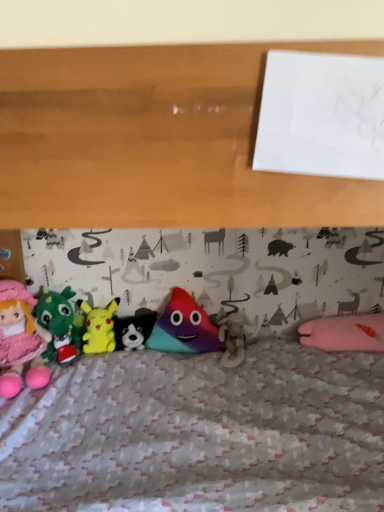
Image resolution: width=384 pixels, height=512 pixels. In order to click on yellow plush toy at center, acting as the fourth toy starting from the right in this screenshot , I will do `click(99, 327)`.

The image size is (384, 512). What do you see at coordinates (231, 337) in the screenshot?
I see `fluffy white teddy bear at center, the 1th toy when ordered from right to left` at bounding box center [231, 337].

Measure the distance between point (224,345) and camera.

A distance of 1.73 meters exists between point (224,345) and camera.

The image size is (384, 512). Describe the element at coordinates (20, 340) in the screenshot. I see `matte pink plush doll at left, which is counted as the 6th toy, starting from the right` at that location.

Identify the location of yellow plush toy at center, acting as the fourth toy starting from the right. (99, 327).

From the image's perspective, which one is positioned lower, multicolored plush toy at center, which is the second toy from right to left, or matte pink plush doll at left, which is counted as the 6th toy, starting from the right?

matte pink plush doll at left, which is counted as the 6th toy, starting from the right, from the image's perspective.

In the scene shown: Is multicolored plush toy at center, which is the second toy from right to left, looking in the opposite direction of matte pink plush doll at left, which is counted as the first toy, starting from the left?

No, multicolored plush toy at center, which is the second toy from right to left,'s orientation is not away from matte pink plush doll at left, which is counted as the first toy, starting from the left.

Can you tell me how much multicolored plush toy at center, which is the second toy from right to left, and matte pink plush doll at left, which is counted as the first toy, starting from the left, differ in facing direction?

multicolored plush toy at center, which is the second toy from right to left, and matte pink plush doll at left, which is counted as the first toy, starting from the left, are facing 34.4 degrees away from each other.

Considering the sizes of white plush dog at center, marked as the fourth toy in a left-to-right arrangement, and multicolored plush toy at center, which is the second toy from right to left, in the image, is white plush dog at center, marked as the fourth toy in a left-to-right arrangement, wider or thinner than multicolored plush toy at center, which is the second toy from right to left,?

white plush dog at center, marked as the fourth toy in a left-to-right arrangement, is wider than multicolored plush toy at center, which is the second toy from right to left.

Can you see white plush dog at center, arranged as the third toy when viewed from the right, touching multicolored plush toy at center, which appears as the 5th toy when viewed from the left?

No, white plush dog at center, arranged as the third toy when viewed from the right, is not in contact with multicolored plush toy at center, which appears as the 5th toy when viewed from the left.

Does white plush dog at center, arranged as the third toy when viewed from the right, turn towards multicolored plush toy at center, which is the second toy from right to left?

No, white plush dog at center, arranged as the third toy when viewed from the right, is not aimed at multicolored plush toy at center, which is the second toy from right to left.

Choose the correct answer: Is white plush dog at center, arranged as the third toy when viewed from the right, inside multicolored plush toy at center, which is the second toy from right to left, or outside it?

white plush dog at center, arranged as the third toy when viewed from the right, lies outside multicolored plush toy at center, which is the second toy from right to left.

Considering their positions, is matte pink plush doll at left, which is counted as the 6th toy, starting from the right, located in front of or behind fluffy white teddy bear at center, which ranks as the 6th toy in left-to-right order?

In the image, matte pink plush doll at left, which is counted as the 6th toy, starting from the right, appears in front of fluffy white teddy bear at center, which ranks as the 6th toy in left-to-right order.

Is matte pink plush doll at left, which is counted as the 6th toy, starting from the right, inside or outside of fluffy white teddy bear at center, which ranks as the 6th toy in left-to-right order?

matte pink plush doll at left, which is counted as the 6th toy, starting from the right, is spatially situated outside fluffy white teddy bear at center, which ranks as the 6th toy in left-to-right order.

Which is in front, point (16, 368) or point (235, 340)?

Point (16, 368)

Does point (44, 287) lie in front of point (23, 337)?

No.

Is velvet green dragon at left, which appears as the 2th toy when viewed from the left, wider or thinner than matte pink plush doll at left, which is counted as the first toy, starting from the left?

Clearly, velvet green dragon at left, which appears as the 2th toy when viewed from the left, has less width compared to matte pink plush doll at left, which is counted as the first toy, starting from the left.

From the image's perspective, which is above, velvet green dragon at left, the 5th toy in the right-to-left sequence, or matte pink plush doll at left, which is counted as the first toy, starting from the left?

velvet green dragon at left, the 5th toy in the right-to-left sequence, from the image's perspective.

How distant is yellow plush toy at center, marked as the 3th toy in a left-to-right arrangement, from fluffy white teddy bear at center, the 1th toy when ordered from right to left?

18.72 inches.

Is yellow plush toy at center, marked as the 3th toy in a left-to-right arrangement, taller than fluffy white teddy bear at center, the 1th toy when ordered from right to left?

Indeed, yellow plush toy at center, marked as the 3th toy in a left-to-right arrangement, has a greater height compared to fluffy white teddy bear at center, the 1th toy when ordered from right to left.

Is yellow plush toy at center, acting as the fourth toy starting from the right, facing towards fluffy white teddy bear at center, which ranks as the 6th toy in left-to-right order?

No, yellow plush toy at center, acting as the fourth toy starting from the right, is not facing towards fluffy white teddy bear at center, which ranks as the 6th toy in left-to-right order.

What's the angular difference between yellow plush toy at center, marked as the 3th toy in a left-to-right arrangement, and fluffy white teddy bear at center, the 1th toy when ordered from right to left,'s facing directions?

yellow plush toy at center, marked as the 3th toy in a left-to-right arrangement, and fluffy white teddy bear at center, the 1th toy when ordered from right to left, are facing 1.18 degrees away from each other.

Is fluffy white teddy bear at center, which ranks as the 6th toy in left-to-right order, bigger than matte pink plush doll at left, which is counted as the 6th toy, starting from the right?

No, fluffy white teddy bear at center, which ranks as the 6th toy in left-to-right order, is not bigger than matte pink plush doll at left, which is counted as the 6th toy, starting from the right.

Considering the positions of objects fluffy white teddy bear at center, which ranks as the 6th toy in left-to-right order, and matte pink plush doll at left, which is counted as the 6th toy, starting from the right, in the image provided, who is more to the left, fluffy white teddy bear at center, which ranks as the 6th toy in left-to-right order, or matte pink plush doll at left, which is counted as the 6th toy, starting from the right,?

matte pink plush doll at left, which is counted as the 6th toy, starting from the right.

This screenshot has width=384, height=512. I want to click on the 5th toy directly above the fluffy white teddy bear at center, the 1th toy when ordered from right to left (from a real-world perspective), so tap(20, 340).

Is fluffy white teddy bear at center, the 1th toy when ordered from right to left, spatially inside matte pink plush doll at left, which is counted as the 6th toy, starting from the right, or outside of it?

fluffy white teddy bear at center, the 1th toy when ordered from right to left, is spatially situated outside matte pink plush doll at left, which is counted as the 6th toy, starting from the right.

Does fluffy white teddy bear at center, the 1th toy when ordered from right to left, appear on the left side of multicolored plush toy at center, which appears as the 5th toy when viewed from the left?

Incorrect, fluffy white teddy bear at center, the 1th toy when ordered from right to left, is not on the left side of multicolored plush toy at center, which appears as the 5th toy when viewed from the left.

Which object is further away from the camera, fluffy white teddy bear at center, which ranks as the 6th toy in left-to-right order, or multicolored plush toy at center, which appears as the 5th toy when viewed from the left?

multicolored plush toy at center, which appears as the 5th toy when viewed from the left, is more distant.

Is fluffy white teddy bear at center, which ranks as the 6th toy in left-to-right order, surrounding multicolored plush toy at center, which appears as the 5th toy when viewed from the left?

Actually, multicolored plush toy at center, which appears as the 5th toy when viewed from the left, is outside fluffy white teddy bear at center, which ranks as the 6th toy in left-to-right order.

At what (x,y) coordinates should I click in order to perform the action: click on the 2nd toy above the multicolored plush toy at center, which appears as the 5th toy when viewed from the left (from a real-world perspective). Please return your answer as a coordinate pair (x, y). This screenshot has width=384, height=512. Looking at the image, I should click on (20, 340).

This screenshot has width=384, height=512. I want to click on toy that is the 1st one when counting rightward from the white plush dog at center, arranged as the third toy when viewed from the right, so click(x=184, y=327).

Considering their positions, is white plush dog at center, marked as the fourth toy in a left-to-right arrangement, positioned closer to matte pink plush doll at left, which is counted as the 6th toy, starting from the right, than multicolored plush toy at center, which appears as the 5th toy when viewed from the left?

The object closer to matte pink plush doll at left, which is counted as the 6th toy, starting from the right, is white plush dog at center, marked as the fourth toy in a left-to-right arrangement.

When comparing their distances from matte pink plush doll at left, which is counted as the 6th toy, starting from the right, does velvet green dragon at left, which appears as the 2th toy when viewed from the left, or multicolored plush toy at center, which appears as the 5th toy when viewed from the left, seem closer?

Based on the image, velvet green dragon at left, which appears as the 2th toy when viewed from the left, appears to be nearer to matte pink plush doll at left, which is counted as the 6th toy, starting from the right.

From the picture: Estimate the real-world distances between objects in this image. Which object is closer to matte pink plush doll at left, which is counted as the first toy, starting from the left, multicolored plush toy at center, which appears as the 5th toy when viewed from the left, or fluffy white teddy bear at center, which ranks as the 6th toy in left-to-right order?

multicolored plush toy at center, which appears as the 5th toy when viewed from the left, is closer to matte pink plush doll at left, which is counted as the first toy, starting from the left.

When comparing their distances from multicolored plush toy at center, which is the second toy from right to left, does fluffy white teddy bear at center, which ranks as the 6th toy in left-to-right order, or matte pink plush doll at left, which is counted as the 6th toy, starting from the right, seem further?

matte pink plush doll at left, which is counted as the 6th toy, starting from the right, is positioned further to the anchor multicolored plush toy at center, which is the second toy from right to left.

Looking at the image, which one is located closer to yellow plush toy at center, acting as the fourth toy starting from the right, matte pink plush doll at left, which is counted as the 6th toy, starting from the right, or multicolored plush toy at center, which appears as the 5th toy when viewed from the left?

matte pink plush doll at left, which is counted as the 6th toy, starting from the right, lies closer to yellow plush toy at center, acting as the fourth toy starting from the right, than the other object.

Considering their positions, is multicolored plush toy at center, which appears as the 5th toy when viewed from the left, positioned closer to fluffy white teddy bear at center, which ranks as the 6th toy in left-to-right order, than white plush dog at center, marked as the fourth toy in a left-to-right arrangement?

Based on the image, multicolored plush toy at center, which appears as the 5th toy when viewed from the left, appears to be nearer to fluffy white teddy bear at center, which ranks as the 6th toy in left-to-right order.

Looking at the image, which one is located further to matte pink plush doll at left, which is counted as the first toy, starting from the left, yellow plush toy at center, acting as the fourth toy starting from the right, or fluffy white teddy bear at center, the 1th toy when ordered from right to left?

fluffy white teddy bear at center, the 1th toy when ordered from right to left, is positioned further to the anchor matte pink plush doll at left, which is counted as the first toy, starting from the left.

From the image, which object appears to be farther from multicolored plush toy at center, which appears as the 5th toy when viewed from the left, matte pink plush doll at left, which is counted as the first toy, starting from the left, or yellow plush toy at center, acting as the fourth toy starting from the right?

matte pink plush doll at left, which is counted as the first toy, starting from the left.

Find the location of `toy located between yellow plush toy at center, marked as the 3th toy in a left-to-right arrangement, and multicolored plush toy at center, which appears as the 5th toy when viewed from the left, in the left-right direction`. toy located between yellow plush toy at center, marked as the 3th toy in a left-to-right arrangement, and multicolored plush toy at center, which appears as the 5th toy when viewed from the left, in the left-right direction is located at coordinates (134, 329).

At what (x,y) coordinates should I click in order to perform the action: click on toy located between white plush dog at center, marked as the fourth toy in a left-to-right arrangement, and fluffy white teddy bear at center, which ranks as the 6th toy in left-to-right order, in the left-right direction. Please return your answer as a coordinate pair (x, y). Looking at the image, I should click on (184, 327).

This screenshot has width=384, height=512. What are the coordinates of `toy located between velvet green dragon at left, the 5th toy in the right-to-left sequence, and white plush dog at center, arranged as the third toy when viewed from the right, in the left-right direction` in the screenshot? It's located at (99, 327).